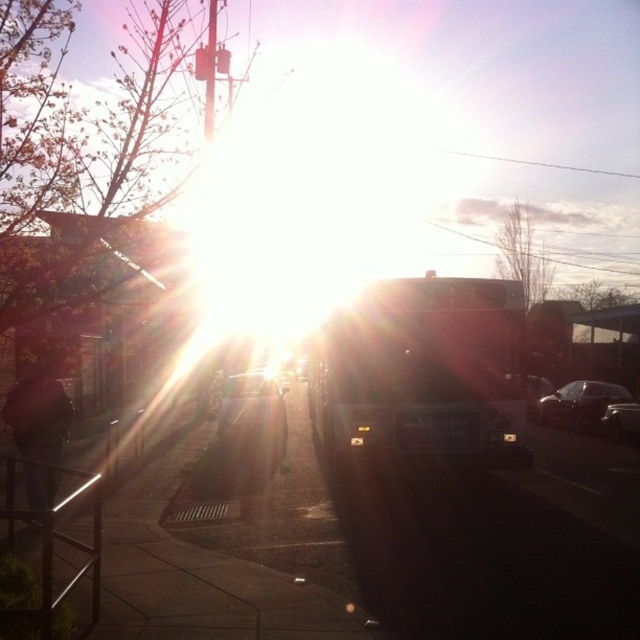
Does metallic silver bus stop at lower left appear on the left side of dark blue jeans at left?

Incorrect, metallic silver bus stop at lower left is not on the left side of dark blue jeans at left.

Who is more distant from viewer, (3, 612) or (51, 493)?

The point (51, 493) is behind.

This screenshot has height=640, width=640. Identify the location of metallic silver bus stop at lower left. (60, 534).

Is dark blue jeans at left closer to the viewer compared to metallic silver car at center?

Yes, it is in front of metallic silver car at center.

Is dark blue jeans at left shorter than metallic silver car at center?

No.

In order to click on dark blue jeans at left in this screenshot , I will do `click(38, 413)`.

Measure the distance between point (260, 401) and camera.

Point (260, 401) is 17.62 meters from camera.

This screenshot has width=640, height=640. What do you see at coordinates (253, 412) in the screenshot?
I see `metallic silver car at center` at bounding box center [253, 412].

Is point (221, 397) behind point (627, 408)?

Yes, point (221, 397) is farther from viewer.

This screenshot has width=640, height=640. In order to click on metallic silver car at center in this screenshot , I will do `click(253, 412)`.